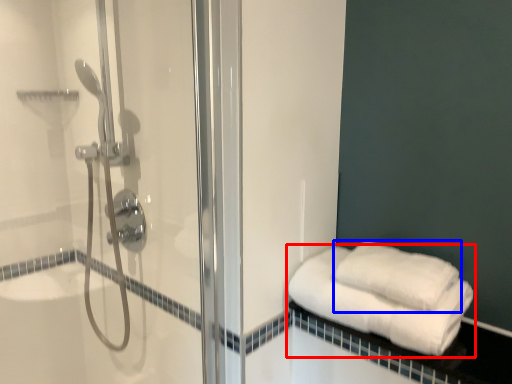
Question: Which object is further to the camera taking this photo, towel (highlighted by a red box) or towel (highlighted by a blue box)?

Choices:
 (A) towel
 (B) towel

Answer: (B)